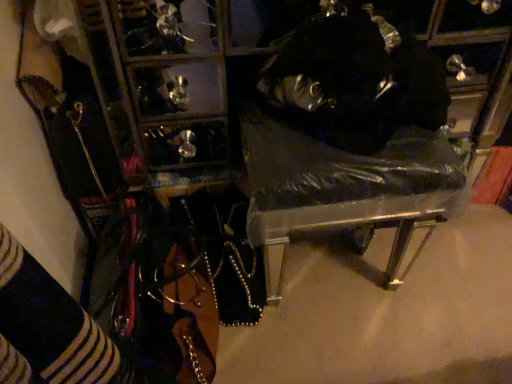
Where is `blank area beneath fuzzy black hat at upper right (from a real-world perspective)`? This screenshot has width=512, height=384. blank area beneath fuzzy black hat at upper right (from a real-world perspective) is located at coordinates (358, 136).